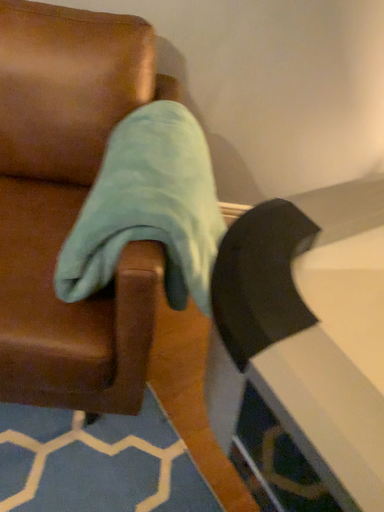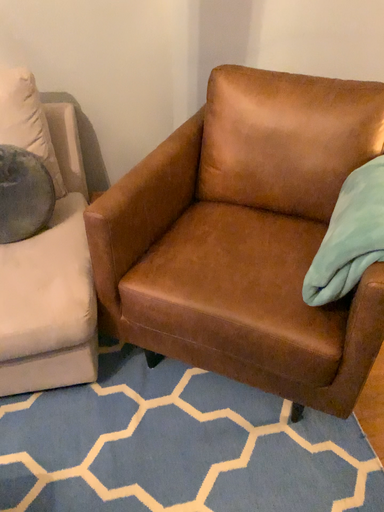
Question: How did the camera likely rotate when shooting the video?

Choices:
 (A) rotated upward
 (B) rotated downward

Answer: (A)